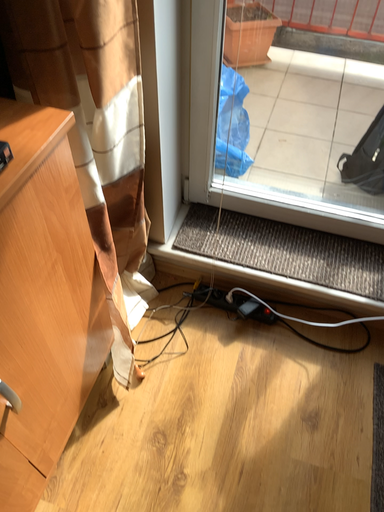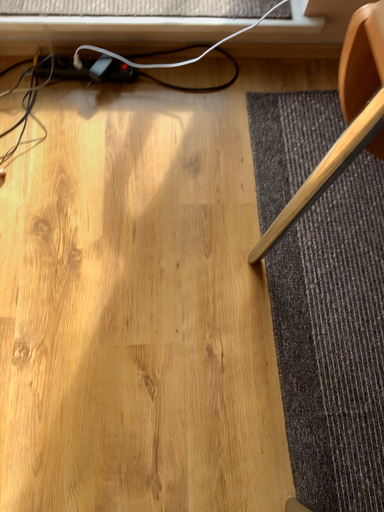
Question: Which way did the camera rotate in the video?

Choices:
 (A) rotated downward
 (B) rotated upward

Answer: (A)